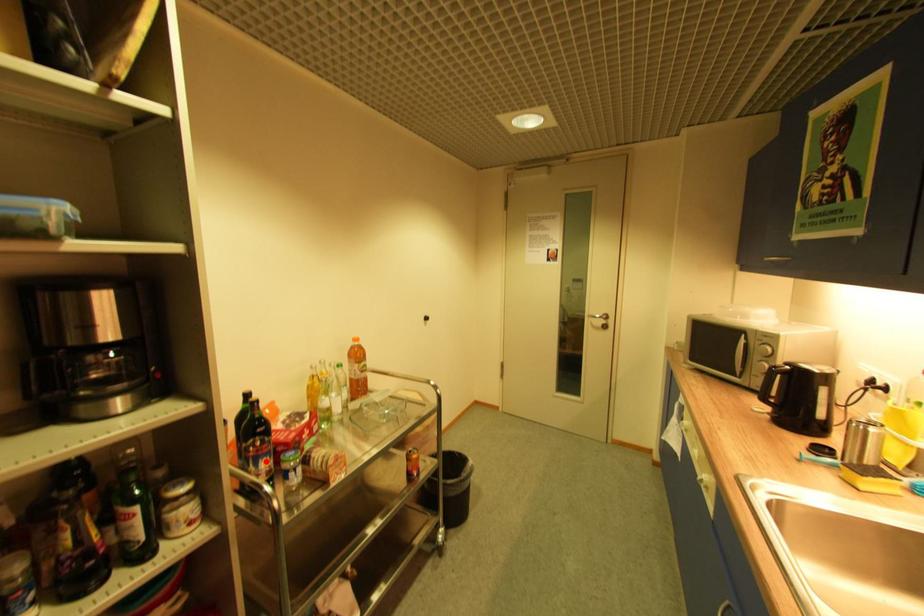
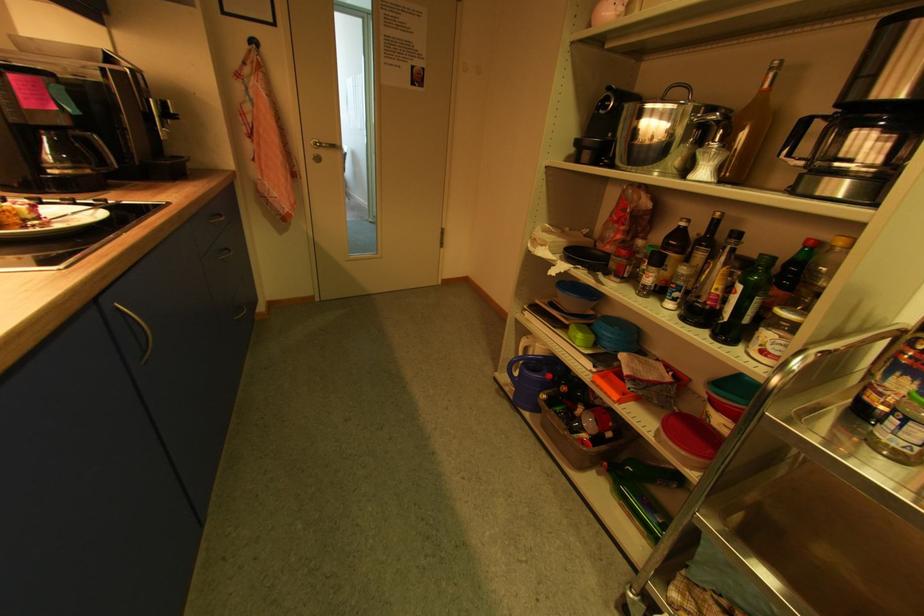
Find the pixel in the second image that matches the highlighted location in the first image.

(904, 375)